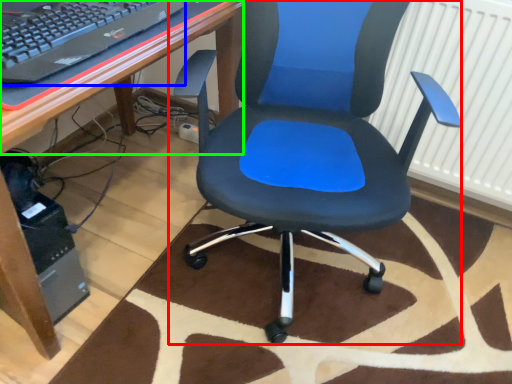
Question: Considering the real-world distances, which object is closest to chair (highlighted by a red box)? computer keyboard (highlighted by a blue box) or computer desk (highlighted by a green box).

Choices:
 (A) computer keyboard
 (B) computer desk

Answer: (B)